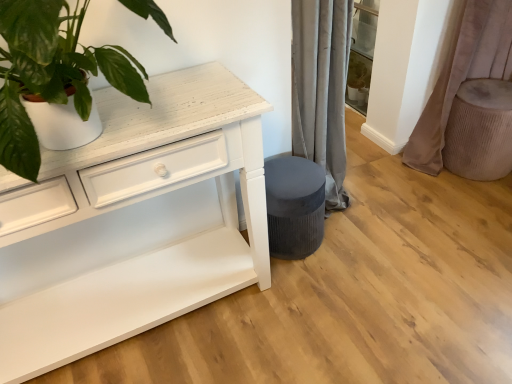
Question: Would you consider white matte plant pot at upper left to be distant from beige textured ottoman at right?

Choices:
 (A) yes
 (B) no

Answer: (A)

Question: Does white matte plant pot at upper left have a smaller size compared to beige textured ottoman at right?

Choices:
 (A) no
 (B) yes

Answer: (A)

Question: From a real-world perspective, is white matte plant pot at upper left beneath beige textured ottoman at right?

Choices:
 (A) no
 (B) yes

Answer: (A)

Question: Can you confirm if white matte plant pot at upper left is bigger than beige textured ottoman at right?

Choices:
 (A) yes
 (B) no

Answer: (A)

Question: Is white matte plant pot at upper left behind beige textured ottoman at right?

Choices:
 (A) yes
 (B) no

Answer: (B)

Question: From a real-world perspective, is velvet beige curtain at right positioned above or below velvet dark gray stool at lower center?

Choices:
 (A) below
 (B) above

Answer: (B)

Question: In the image, is velvet beige curtain at right on the left side or the right side of velvet dark gray stool at lower center?

Choices:
 (A) right
 (B) left

Answer: (A)

Question: Would you say velvet beige curtain at right is inside or outside velvet dark gray stool at lower center?

Choices:
 (A) outside
 (B) inside

Answer: (A)

Question: From the image's perspective, relative to velvet dark gray stool at lower center, is velvet beige curtain at right above or below?

Choices:
 (A) above
 (B) below

Answer: (A)

Question: Considering the positions of velvet dark gray stool at lower center and white matte plant pot at upper left in the image, is velvet dark gray stool at lower center bigger or smaller than white matte plant pot at upper left?

Choices:
 (A) small
 (B) big

Answer: (A)

Question: In the image, is velvet dark gray stool at lower center on the left side or the right side of white matte plant pot at upper left?

Choices:
 (A) right
 (B) left

Answer: (A)

Question: Is velvet dark gray stool at lower center taller or shorter than white matte plant pot at upper left?

Choices:
 (A) tall
 (B) short

Answer: (B)

Question: Looking at their shapes, would you say velvet dark gray stool at lower center is wider or thinner than white matte plant pot at upper left?

Choices:
 (A) wide
 (B) thin

Answer: (B)

Question: Is velvet beige curtain at right bigger or smaller than white matte plant pot at upper left?

Choices:
 (A) small
 (B) big

Answer: (B)

Question: Looking at their shapes, would you say velvet beige curtain at right is wider or thinner than white matte plant pot at upper left?

Choices:
 (A) wide
 (B) thin

Answer: (B)